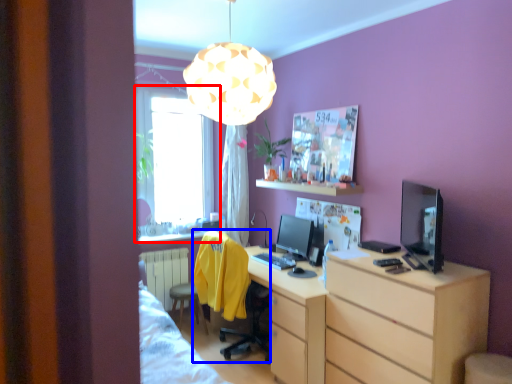
Question: Which point is further to the camera, window (highlighted by a red box) or swivel chair (highlighted by a blue box)?

Choices:
 (A) window
 (B) swivel chair

Answer: (A)